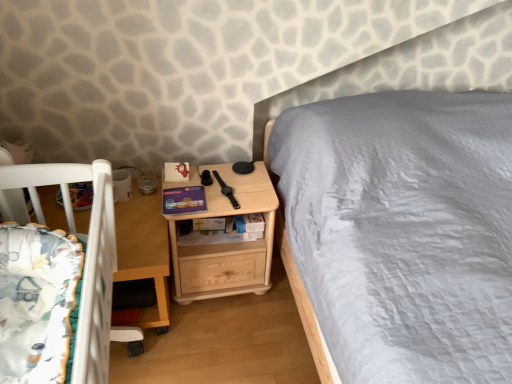
Question: Is fluffy white blanket at lower left smaller than light wood/texture nightstand at center?

Choices:
 (A) yes
 (B) no

Answer: (A)

Question: Is fluffy white blanket at lower left positioned with its back to light wood/texture nightstand at center?

Choices:
 (A) yes
 (B) no

Answer: (B)

Question: Can you confirm if fluffy white blanket at lower left is positioned to the left of light wood/texture nightstand at center?

Choices:
 (A) yes
 (B) no

Answer: (A)

Question: Is fluffy white blanket at lower left shorter than light wood/texture nightstand at center?

Choices:
 (A) no
 (B) yes

Answer: (B)

Question: Can you confirm if fluffy white blanket at lower left is thinner than light wood/texture nightstand at center?

Choices:
 (A) no
 (B) yes

Answer: (B)

Question: In the image, is wooden table at lower left on the left side or the right side of light wood/texture nightstand at center?

Choices:
 (A) right
 (B) left

Answer: (B)

Question: Considering the positions of wooden table at lower left and light wood/texture nightstand at center in the image, is wooden table at lower left bigger or smaller than light wood/texture nightstand at center?

Choices:
 (A) small
 (B) big

Answer: (B)

Question: From a real-world perspective, is wooden table at lower left above or below light wood/texture nightstand at center?

Choices:
 (A) above
 (B) below

Answer: (B)

Question: Looking at their shapes, would you say wooden table at lower left is wider or thinner than light wood/texture nightstand at center?

Choices:
 (A) wide
 (B) thin

Answer: (A)

Question: Based on their positions, is wooden table at lower left located to the left or right of fluffy white blanket at lower left?

Choices:
 (A) right
 (B) left

Answer: (B)

Question: From their relative heights in the image, would you say wooden table at lower left is taller or shorter than fluffy white blanket at lower left?

Choices:
 (A) tall
 (B) short

Answer: (A)

Question: From the image's perspective, relative to fluffy white blanket at lower left, is wooden table at lower left above or below?

Choices:
 (A) below
 (B) above

Answer: (A)

Question: Is wooden table at lower left spatially inside fluffy white blanket at lower left, or outside of it?

Choices:
 (A) outside
 (B) inside

Answer: (A)

Question: Looking at their shapes, would you say light wood/texture nightstand at center is wider or thinner than fluffy white blanket at lower left?

Choices:
 (A) thin
 (B) wide

Answer: (B)

Question: Would you say light wood/texture nightstand at center is to the left or to the right of fluffy white blanket at lower left in the picture?

Choices:
 (A) left
 (B) right

Answer: (B)